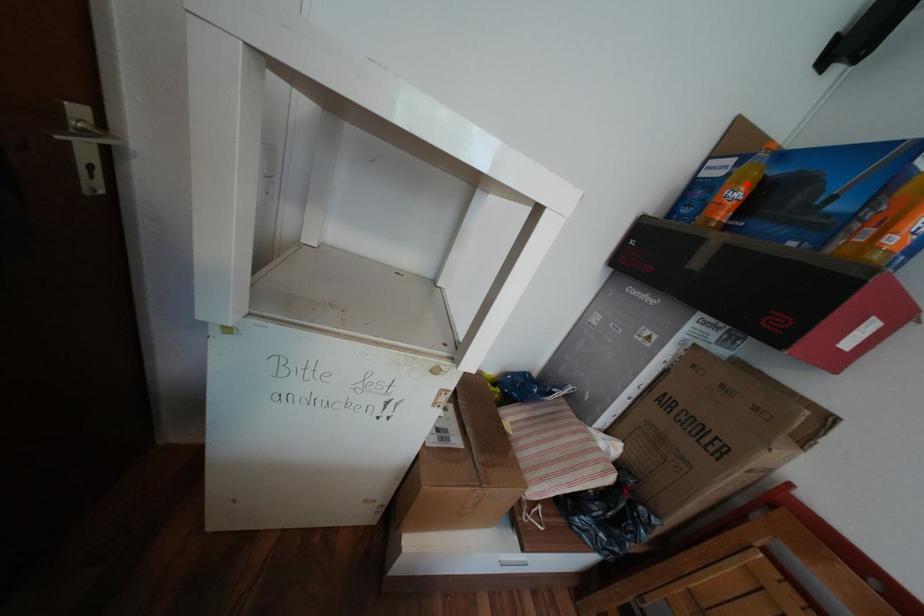
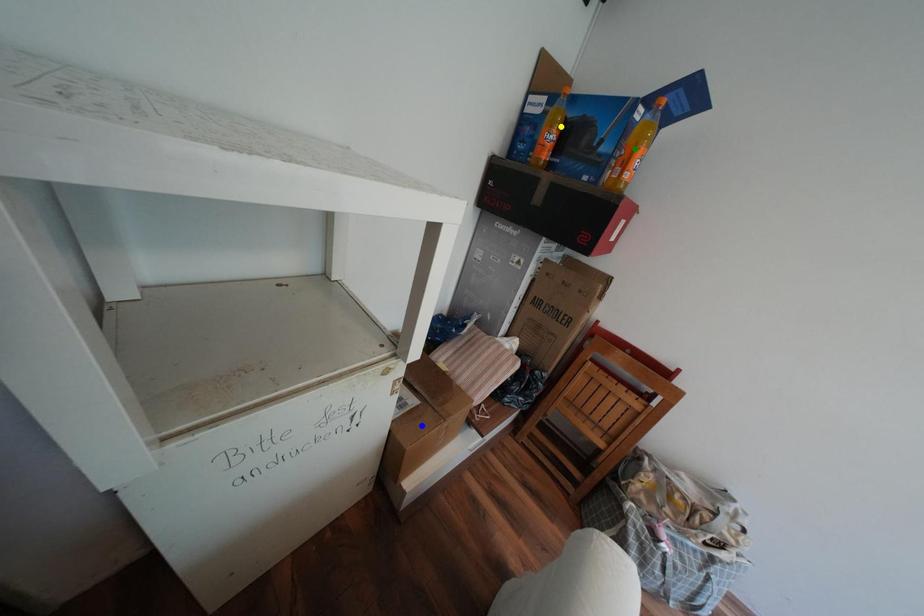
Question: I am providing you with two images of the same scene from different viewpoints. A red point is marked on the first image. You are given multiple points on the second image. Can you choose the point in image 2 that corresponds to the point in image 1?

Choices:
 (A) green point
 (B) yellow point
 (C) blue point

Answer: (B)